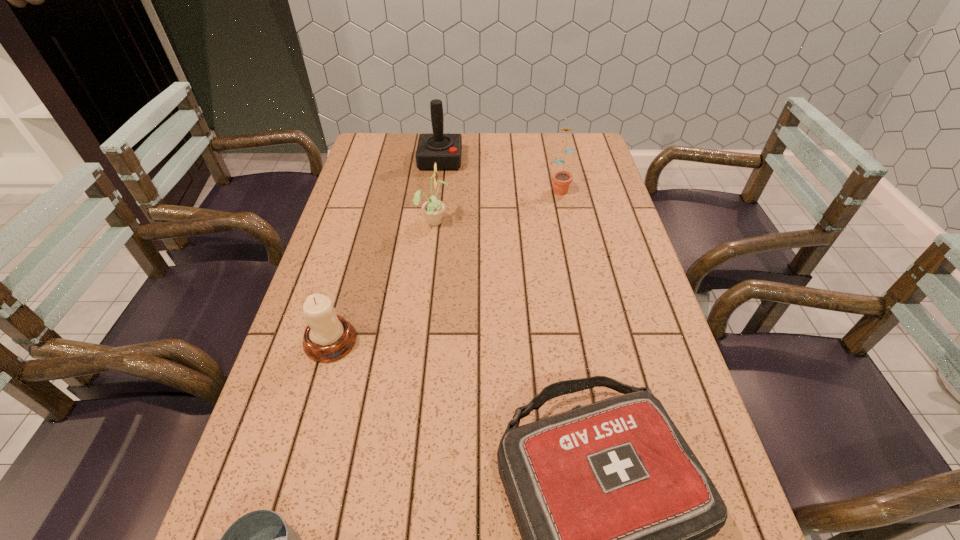
What are the coordinates of `joystick` in the screenshot? It's located at click(x=445, y=150).

This screenshot has height=540, width=960. Identify the location of the right sunflower. (561, 180).

At what (x,y) coordinates should I click in order to perform the action: click on the farther sunflower. Please return your answer as a coordinate pair (x, y). The image size is (960, 540). Looking at the image, I should click on (561, 180).

The height and width of the screenshot is (540, 960). I want to click on the left sunflower, so click(433, 208).

The height and width of the screenshot is (540, 960). What are the coordinates of `the third farthest object` in the screenshot? It's located at [433, 208].

Identify the location of the third shortest object. Image resolution: width=960 pixels, height=540 pixels. (328, 337).

Locate an element on the screen. The width and height of the screenshot is (960, 540). the third nearest object is located at coordinates (328, 337).

At what (x,y) coordinates should I click in order to perform the action: click on free space located 0.370m on the base of the joystick. Please return your answer as a coordinate pair (x, y). The image size is (960, 540). Looking at the image, I should click on (430, 246).

Locate an element on the screen. The height and width of the screenshot is (540, 960). vacant space positioned on the flower of the second farthest object is located at coordinates (566, 219).

Identify the location of free space located 0.190m on the front-facing side of the third farthest object. The image size is (960, 540). (514, 221).